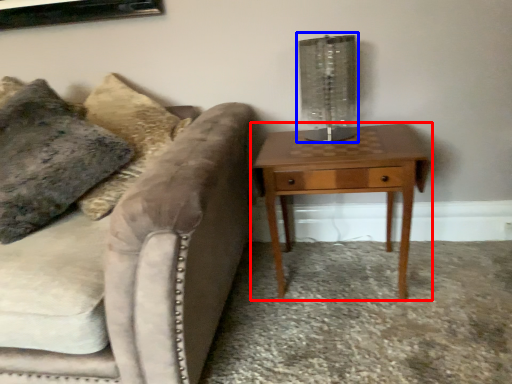
Question: Which point is closer to the camera, nightstand (highlighted by a red box) or table lamp (highlighted by a blue box)?

Choices:
 (A) nightstand
 (B) table lamp

Answer: (A)